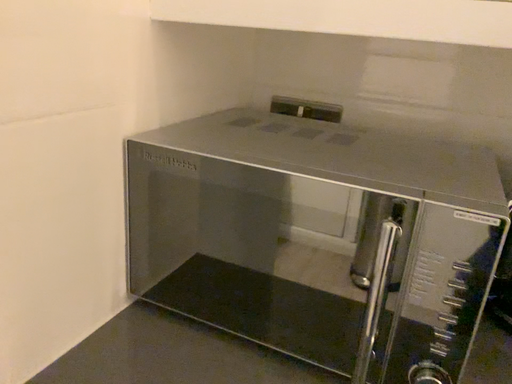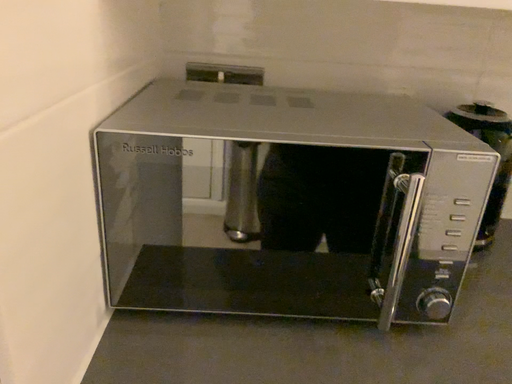
Question: Which way did the camera rotate in the video?

Choices:
 (A) rotated right
 (B) rotated left

Answer: (A)